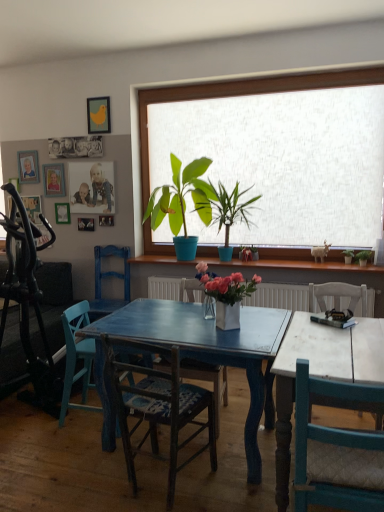
Question: From the image's perspective, would you say wooden picture frame at upper left, marked as the fourth picture frame in a right-to-left arrangement, is shown under wooden chair with woven seat at center, marked as the 4th chair in a back-to-front arrangement?

Choices:
 (A) no
 (B) yes

Answer: (A)

Question: Is wooden picture frame at upper left, the second picture frame from the left, closer to the viewer compared to wooden chair with woven seat at center, which ranks as the 2th chair in front-to-back order?

Choices:
 (A) no
 (B) yes

Answer: (A)

Question: Considering the relative sizes of wooden picture frame at upper left, the second picture frame from the left, and wooden chair with woven seat at center, which ranks as the 2th chair in front-to-back order, in the image provided, is wooden picture frame at upper left, the second picture frame from the left, taller than wooden chair with woven seat at center, which ranks as the 2th chair in front-to-back order,?

Choices:
 (A) no
 (B) yes

Answer: (A)

Question: Is wooden picture frame at upper left, the second picture frame from the left, wider than wooden chair with woven seat at center, which ranks as the 2th chair in front-to-back order?

Choices:
 (A) yes
 (B) no

Answer: (B)

Question: Could you tell me if wooden picture frame at upper left, the second picture frame from the left, is facing wooden chair with woven seat at center, marked as the 4th chair in a back-to-front arrangement?

Choices:
 (A) no
 (B) yes

Answer: (A)

Question: In terms of size, does teal wood chair at right, the first chair from the front, appear bigger or smaller than wooden picture frame at upper left, which appears as the 3th picture frame when viewed from the left?

Choices:
 (A) small
 (B) big

Answer: (B)

Question: Based on their positions, is teal wood chair at right, the first chair from the front, located to the left or right of wooden picture frame at upper left, which is the 3th picture frame in right-to-left order?

Choices:
 (A) left
 (B) right

Answer: (B)

Question: Is teal wood chair at right, the first chair from the front, wider or thinner than wooden picture frame at upper left, which appears as the 3th picture frame when viewed from the left?

Choices:
 (A) thin
 (B) wide

Answer: (B)

Question: Is point (301, 386) closer or farther from the camera than point (64, 216)?

Choices:
 (A) closer
 (B) farther

Answer: (A)

Question: In the image, is green matte plant at center, the 3th houseplant from the front, positioned in front of or behind wooden picture frame at upper left, which is the 3th picture frame in right-to-left order?

Choices:
 (A) behind
 (B) front

Answer: (B)

Question: Would you say green matte plant at center, positioned as the 1th houseplant in left-to-right order, is to the left or to the right of wooden picture frame at upper left, which is the 3th picture frame in right-to-left order, in the picture?

Choices:
 (A) left
 (B) right

Answer: (B)

Question: Choose the correct answer: Is green matte plant at center, positioned as the 1th houseplant in left-to-right order, inside wooden picture frame at upper left, which is the 3th picture frame in right-to-left order, or outside it?

Choices:
 (A) inside
 (B) outside

Answer: (B)

Question: From the image's perspective, is green matte plant at center, which ranks as the third houseplant in back-to-front order, positioned above or below wooden picture frame at upper left, which is the 3th picture frame in right-to-left order?

Choices:
 (A) above
 (B) below

Answer: (A)

Question: From the image's perspective, is green matte plant at right, which is the 4th houseplant from left to right, above or below wooden chair with woven seat at center, marked as the 4th chair in a back-to-front arrangement?

Choices:
 (A) below
 (B) above

Answer: (B)

Question: In terms of width, does green matte plant at right, which is the 4th houseplant from left to right, look wider or thinner when compared to wooden chair with woven seat at center, marked as the 4th chair in a back-to-front arrangement?

Choices:
 (A) thin
 (B) wide

Answer: (A)